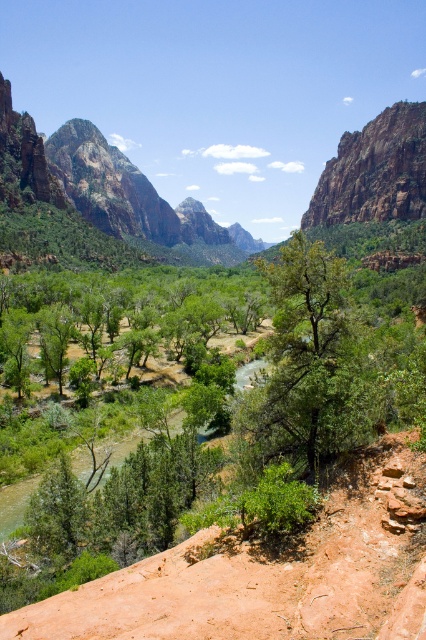
You are a hiker who wants to take a photo of the green matte tree at center and the green leafy trees at center. Which one would you focus on first if you want to capture both in a single frame?

The green matte tree at center is thinner than the green leafy trees at center, so you should focus on the green leafy trees at center first as they are larger and more prominent in the scene.

You are an environmental scientist assessing the canyon. You observe the green matte tree at center and the rustic rock cliff at upper right. Which object has a narrower width?

The green matte tree at center is thinner than the rustic rock cliff at upper right, so the green matte tree at center has a narrower width.